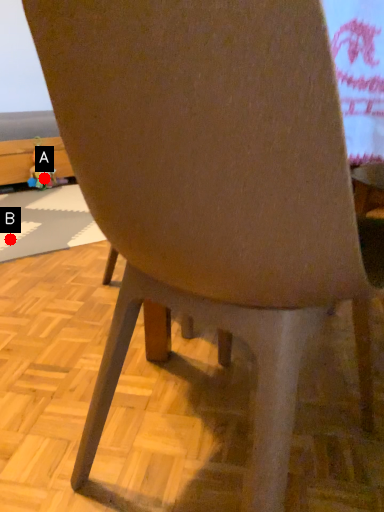
Question: Two points are circled on the image, labeled by A and B beside each circle. Which point is closer to the camera?

Choices:
 (A) A is closer
 (B) B is closer

Answer: (B)